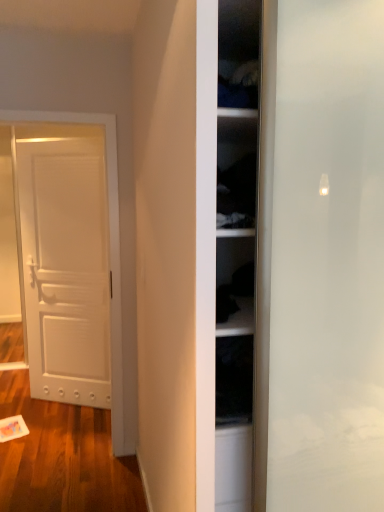
What are the coordinates of `free region under white matte door at left (from a real-world perspective)` in the screenshot? It's located at (71, 403).